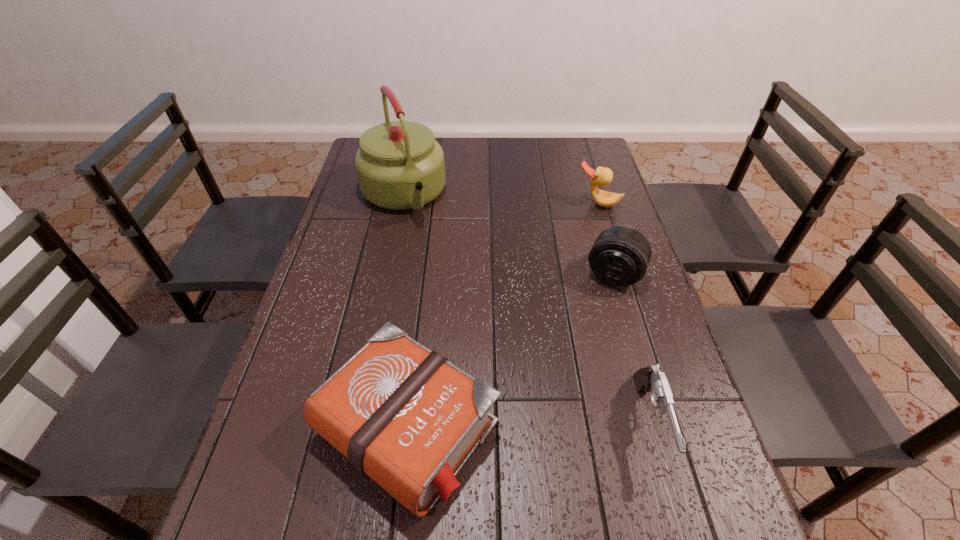
Image resolution: width=960 pixels, height=540 pixels. Identify the location of unoccupied position between the kettle and the duck. (500, 199).

The height and width of the screenshot is (540, 960). I want to click on free space between the duck and the gun, so coord(624,313).

This screenshot has height=540, width=960. I want to click on vacant space in between the gun and the duck, so click(624, 313).

You are a GUI agent. You are given a task and a screenshot of the screen. Output one action in this format:
    pyautogui.click(x=<x>, y=<y>)
    Task: Click on the vacant area that lies between the duck and the Bible
    This screenshot has height=540, width=960.
    Given the screenshot: What is the action you would take?
    pyautogui.click(x=503, y=315)

You are a GUI agent. You are given a task and a screenshot of the screen. Output one action in this format:
    pyautogui.click(x=<x>, y=<y>)
    Task: Click on the free space that is in between the gun and the kettle
    This screenshot has width=960, height=540.
    Given the screenshot: What is the action you would take?
    pyautogui.click(x=527, y=309)

The image size is (960, 540). I want to click on unoccupied position between the telephoto lens and the kettle, so click(508, 234).

Identify the location of unoccupied area between the Bible and the third farthest object. The image size is (960, 540). (511, 350).

Find the location of a particular element. vacant point located between the gun and the third farthest object is located at coordinates (632, 348).

You are a GUI agent. You are given a task and a screenshot of the screen. Output one action in this format:
    pyautogui.click(x=<x>, y=<y>)
    Task: Click on the free space between the duck and the Bible
    Image resolution: width=960 pixels, height=540 pixels.
    Given the screenshot: What is the action you would take?
    pyautogui.click(x=503, y=315)

Identify the location of free space between the telephoto lens and the Bible. The height and width of the screenshot is (540, 960). (511, 350).